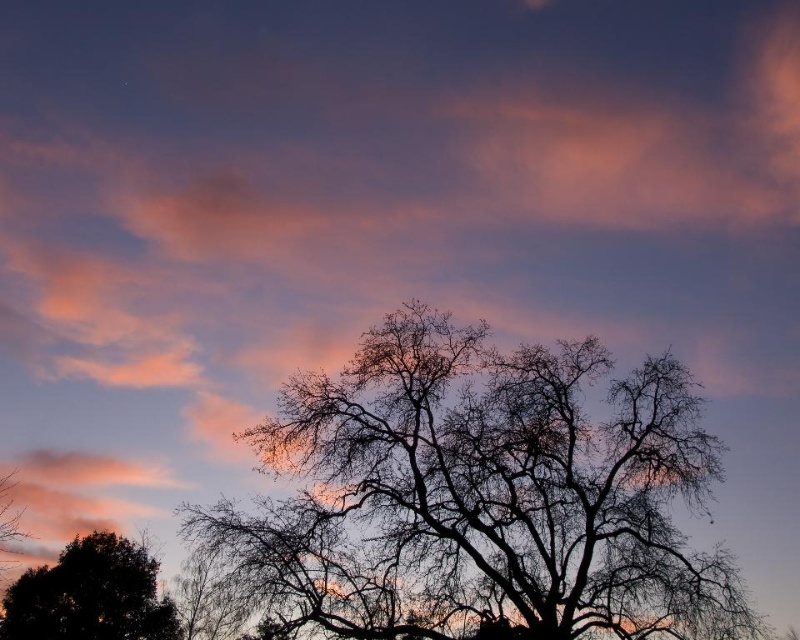
You are an astronomer analyzing the image. You notice a point at coordinates point (482, 497). Based on the scene description, what object does this point most likely correspond to?

The point (482, 497) corresponds to the black silhouette tree at center, as it is the central focus of the scene and the coordinates align with its position.

You are standing in the field and see the black silhouette tree at center and the dark green leafy tree at lower left. Which tree is closer to you?

The dark green leafy tree at lower left is closer to you because the black silhouette tree at center is positioned over it, indicating it is farther away.